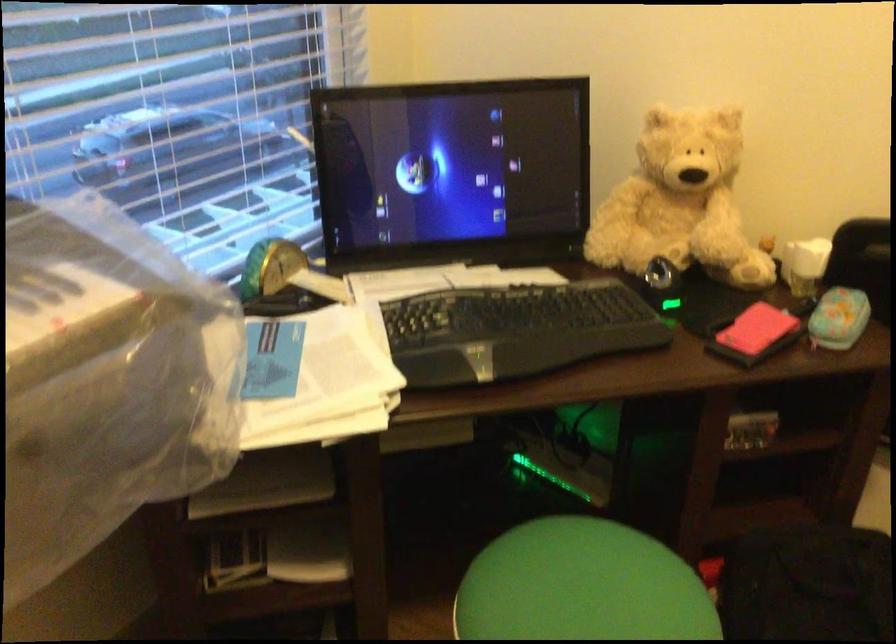
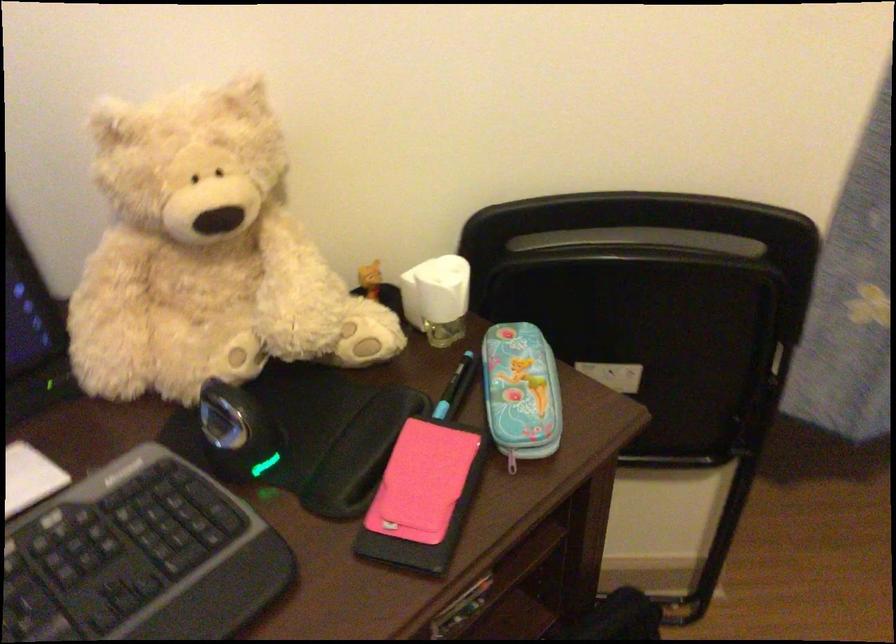
In the second image, find the point that corresponds to (x=754, y=325) in the first image.

(421, 482)